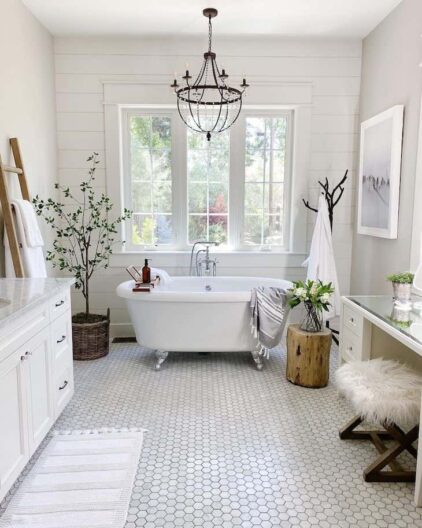
What are the coordinates of `white throw rug` in the screenshot? It's located at (76, 490).